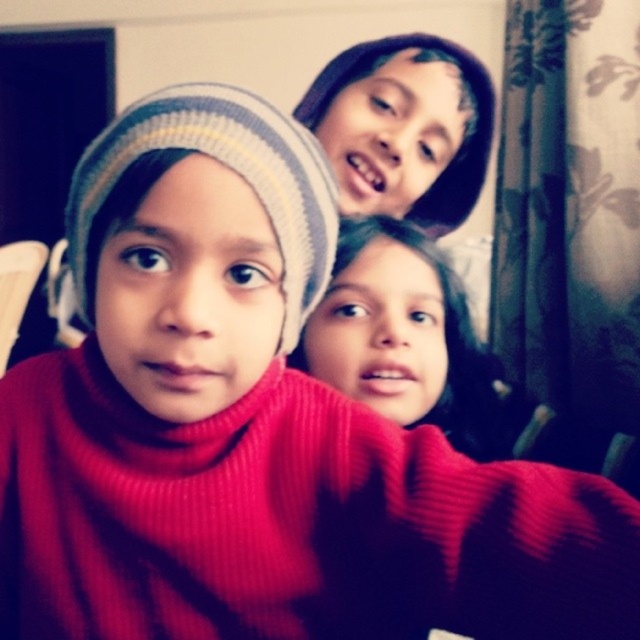
Question: Is striped knit beanie at center bigger than matte black beanie at upper center?

Choices:
 (A) yes
 (B) no

Answer: (B)

Question: Which point is closer to the camera?

Choices:
 (A) matte black beanie at upper center
 (B) striped knit beanie at center

Answer: (B)

Question: Does striped knit beanie at center appear under matte black beanie at upper center?

Choices:
 (A) yes
 (B) no

Answer: (A)

Question: Can you confirm if striped knit beanie at center is positioned to the right of matte black beanie at upper center?

Choices:
 (A) yes
 (B) no

Answer: (B)